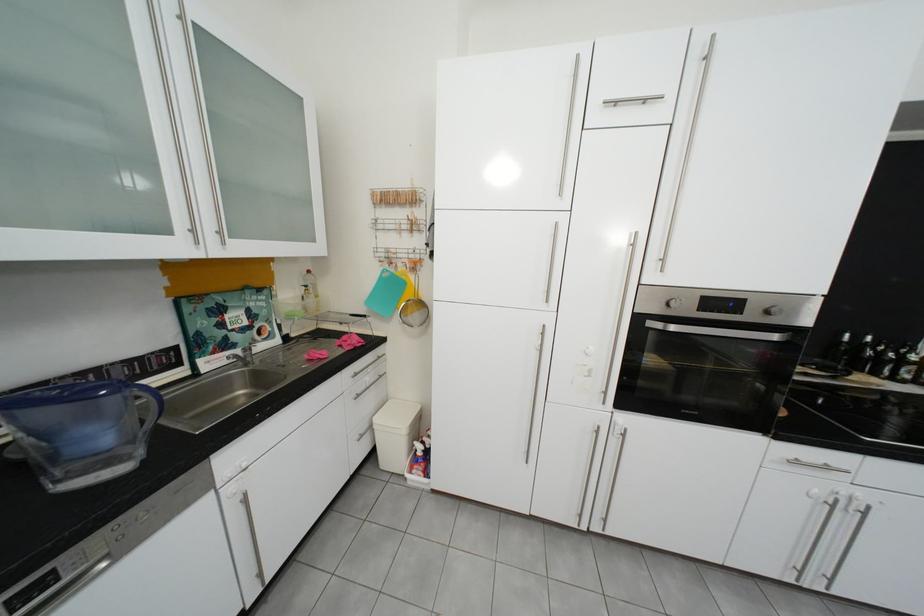
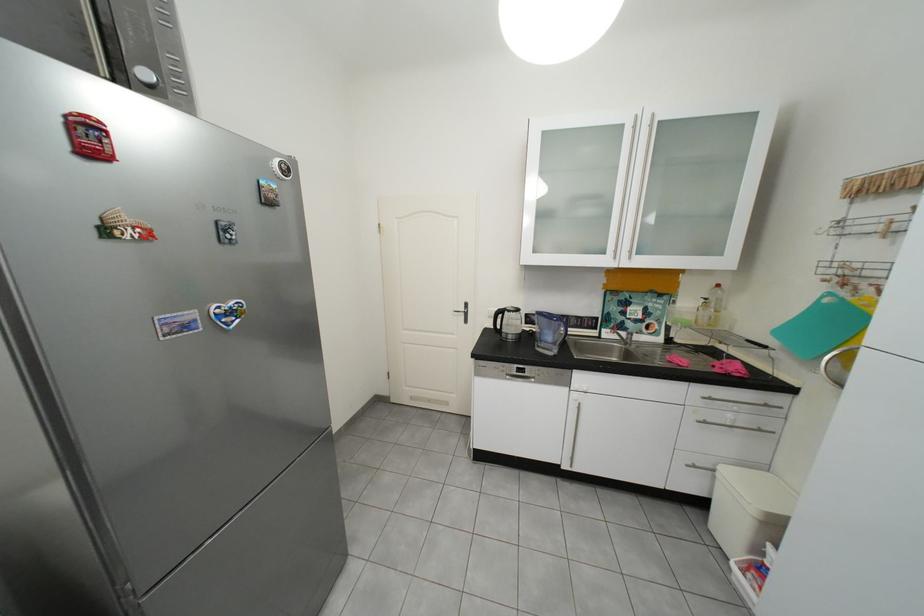
Find the pixel in the second image that matches (372,437) in the first image.

(707, 468)